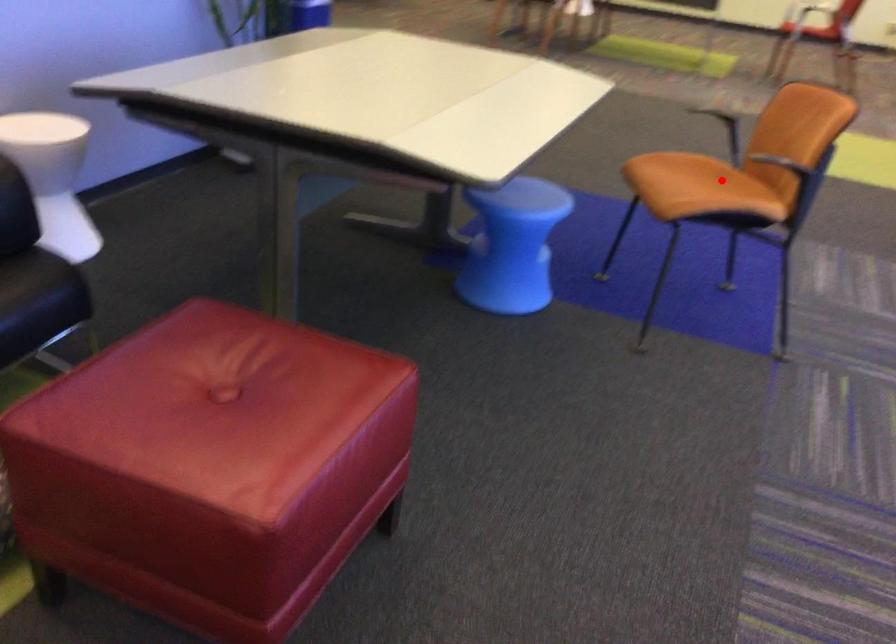
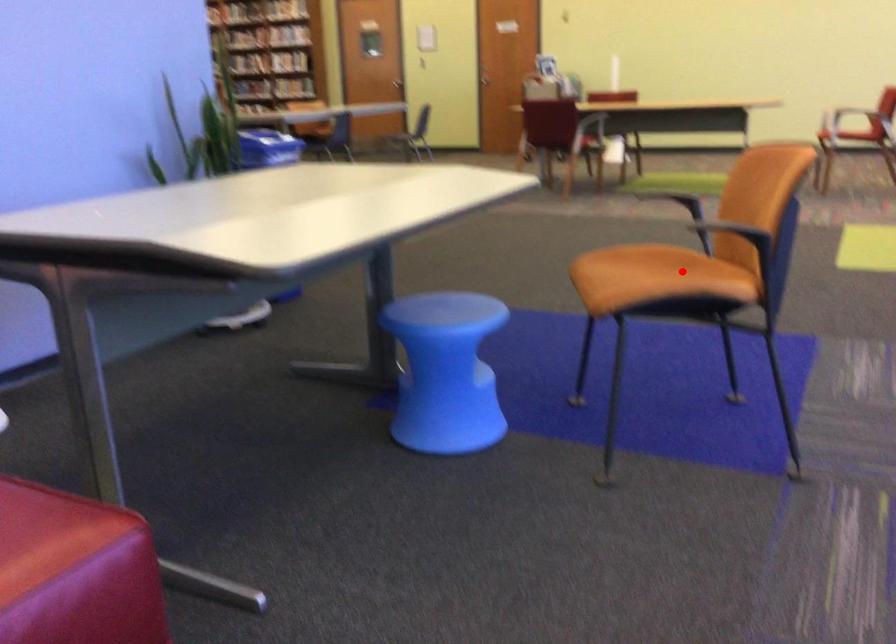
I am providing you with two images of the same scene from different viewpoints. A red point is marked on the first image and another point is marked on the second image. Is the red point in image1 aligned with the point shown in image2?

Yes